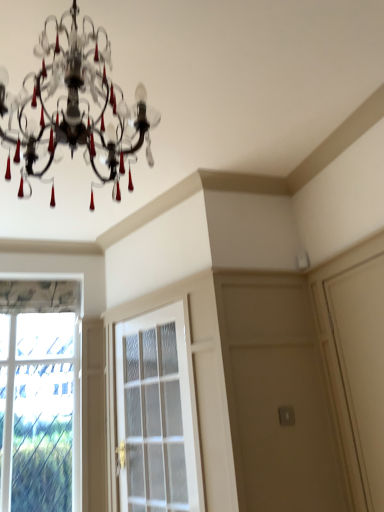
You are a GUI agent. You are given a task and a screenshot of the screen. Output one action in this format:
    pyautogui.click(x=<x>, y=<y>)
    Task: Click on the clear glass window at left
    Image resolution: width=384 pixels, height=512 pixels.
    Given the screenshot: What is the action you would take?
    pyautogui.click(x=40, y=395)

Would you say white glass screen door at center is a long distance from matte black chandelier at upper center?

Yes, white glass screen door at center and matte black chandelier at upper center are located far from each other.

In the scene shown: Is white glass screen door at center not inside matte black chandelier at upper center?

white glass screen door at center is positioned outside matte black chandelier at upper center.

Considering the sizes of white glass screen door at center and matte black chandelier at upper center in the image, is white glass screen door at center wider or thinner than matte black chandelier at upper center?

Considering their sizes, white glass screen door at center looks slimmer than matte black chandelier at upper center.

How far apart are white glass screen door at center and matte black chandelier at upper center?

4.68 feet.

Does matte black chandelier at upper center appear on the right side of white glass screen door at center?

No.

Consider the image. What's the angular difference between matte black chandelier at upper center and white glass screen door at center's facing directions?

The angular difference between matte black chandelier at upper center and white glass screen door at center is 67.9 degrees.

Is matte black chandelier at upper center in contact with white glass screen door at center?

matte black chandelier at upper center and white glass screen door at center are not in contact.

Between matte black chandelier at upper center and white glass screen door at center, which one has more height?

white glass screen door at center.

Which point is more forward, (79,296) or (138,422)?

The point (138,422) is closer.

Between clear glass window at left and white glass screen door at center, which one appears on the left side from the viewer's perspective?

From the viewer's perspective, clear glass window at left appears more on the left side.

From a real-world perspective, which object rests below the other?

In real-world perspective, white glass screen door at center is lower.

From the image's perspective, which object appears higher, clear glass window at left or white glass screen door at center?

white glass screen door at center is shown above in the image.

Consider the image. Can you confirm if clear glass window at left is taller than matte black chandelier at upper center?

Correct, clear glass window at left is much taller as matte black chandelier at upper center.

Choose the correct answer: Is clear glass window at left inside matte black chandelier at upper center or outside it?

clear glass window at left is located beyond the bounds of matte black chandelier at upper center.

Is clear glass window at left next to matte black chandelier at upper center and touching it?

There is a gap between clear glass window at left and matte black chandelier at upper center.

Who is more distant, clear glass window at left or matte black chandelier at upper center?

clear glass window at left is behind.

Which of these two, matte black chandelier at upper center or clear glass window at left, stands shorter?

matte black chandelier at upper center is shorter.

Where is `lamp above the clear glass window at left (from the image's perspective)`? lamp above the clear glass window at left (from the image's perspective) is located at coordinates (76, 108).

Is clear glass window at left at the back of matte black chandelier at upper center?

Absolutely, matte black chandelier at upper center is directed away from clear glass window at left.

Is matte black chandelier at upper center inside or outside of clear glass window at left?

matte black chandelier at upper center is spatially situated outside clear glass window at left.

Is clear glass window at left completely or partially inside white glass screen door at center?

That's incorrect, clear glass window at left is not inside white glass screen door at center.

Locate an element on the screen. screen door on the right of clear glass window at left is located at coordinates (155, 413).

Does point (123, 497) lie in front of point (73, 502)?

Yes, point (123, 497) is in front of point (73, 502).

Looking at this image, from the image's perspective, does white glass screen door at center appear higher than clear glass window at left?

Correct, white glass screen door at center appears higher than clear glass window at left in the image.

Where is `lamp positioned vertically above the white glass screen door at center (from a real-world perspective)`? lamp positioned vertically above the white glass screen door at center (from a real-world perspective) is located at coordinates (76, 108).

You are a GUI agent. You are given a task and a screenshot of the screen. Output one action in this format:
    pyautogui.click(x=<x>, y=<y>)
    Task: Click on the screen door behind the matte black chandelier at upper center
    Image resolution: width=384 pixels, height=512 pixels.
    Given the screenshot: What is the action you would take?
    [155, 413]

Looking at the image, which one is located further to white glass screen door at center, clear glass window at left or matte black chandelier at upper center?

matte black chandelier at upper center is further to white glass screen door at center.

Based on their spatial positions, is matte black chandelier at upper center or clear glass window at left closer to white glass screen door at center?

Among the two, clear glass window at left is located nearer to white glass screen door at center.

Looking at the image, which one is located further to matte black chandelier at upper center, white glass screen door at center or clear glass window at left?

clear glass window at left is positioned further to the anchor matte black chandelier at upper center.

Based on their spatial positions, is matte black chandelier at upper center or white glass screen door at center further from clear glass window at left?

The object further to clear glass window at left is matte black chandelier at upper center.

From the image, which object appears to be farther from clear glass window at left, white glass screen door at center or matte black chandelier at upper center?

The object further to clear glass window at left is matte black chandelier at upper center.

Looking at the image, which one is located closer to matte black chandelier at upper center, clear glass window at left or white glass screen door at center?

white glass screen door at center lies closer to matte black chandelier at upper center than the other object.

Identify the location of screen door between matte black chandelier at upper center and clear glass window at left along the z-axis. (155, 413).